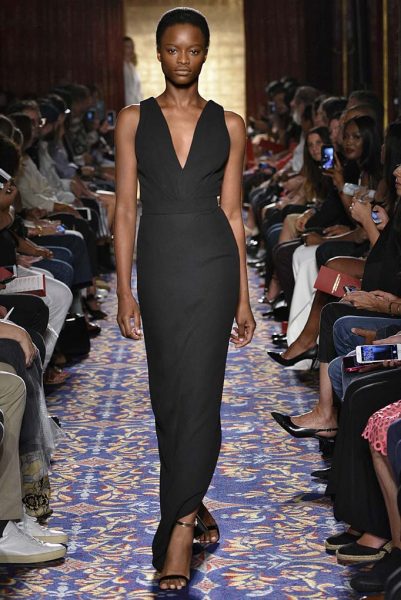
Identify the location of floor. (275, 542).